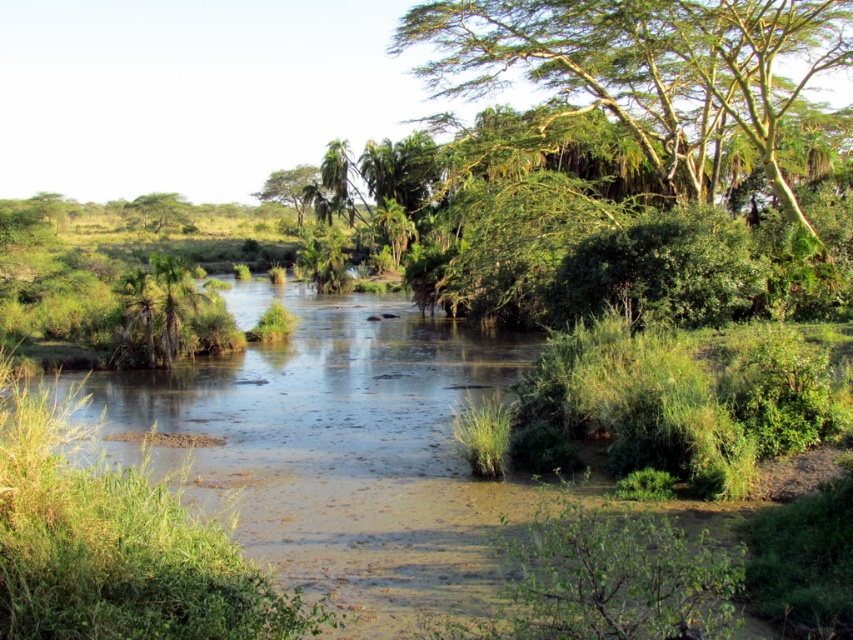
Can you confirm if green leafy tree at center is smaller than green leafy tree at upper left?

No.

From the picture: Is green leafy tree at center shorter than green leafy tree at upper left?

In fact, green leafy tree at center may be taller than green leafy tree at upper left.

Image resolution: width=853 pixels, height=640 pixels. Describe the element at coordinates (289, 188) in the screenshot. I see `green leafy tree at center` at that location.

Locate an element on the screen. The width and height of the screenshot is (853, 640). green leafy tree at center is located at coordinates (289, 188).

Is point (577, 70) closer to camera compared to point (178, 205)?

That is True.

Is green leafy tree at upper right further to the viewer compared to green leafy tree at upper left?

No.

Describe the element at coordinates (648, 68) in the screenshot. Image resolution: width=853 pixels, height=640 pixels. I see `green leafy tree at upper right` at that location.

In order to click on green leafy tree at upper right in this screenshot , I will do `click(648, 68)`.

Who is lower down, green leafy tree at upper right or green leafy tree at center?

green leafy tree at upper right

Measure the distance from green leafy tree at upper right to green leafy tree at center.

green leafy tree at upper right is 60.29 meters away from green leafy tree at center.

Between point (529, 8) and point (277, 195), which one is positioned in front?

Point (529, 8)

Locate an element on the screen. green leafy tree at upper right is located at coordinates (648, 68).